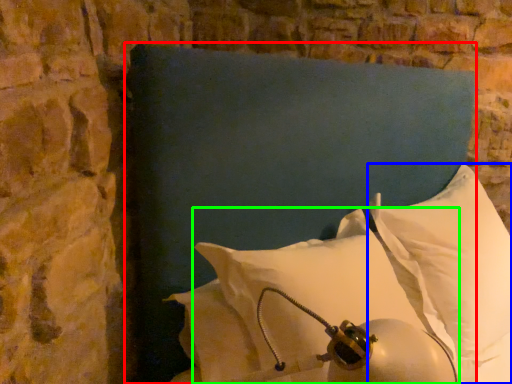
Question: Based on their relative distances, which object is nearer to pillow (highlighted by a red box)? Choose from pillow (highlighted by a blue box) and pillow (highlighted by a green box).

Choices:
 (A) pillow
 (B) pillow

Answer: (B)